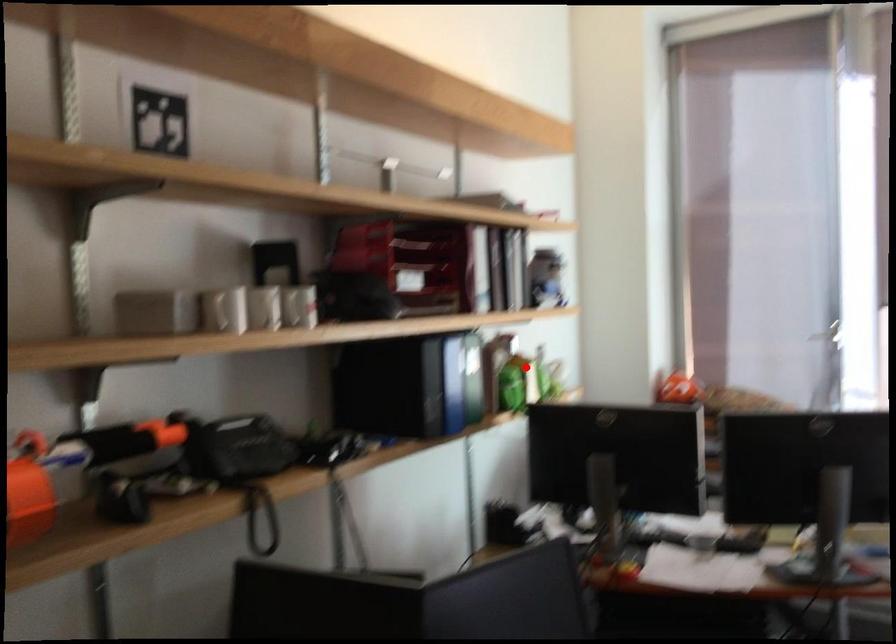
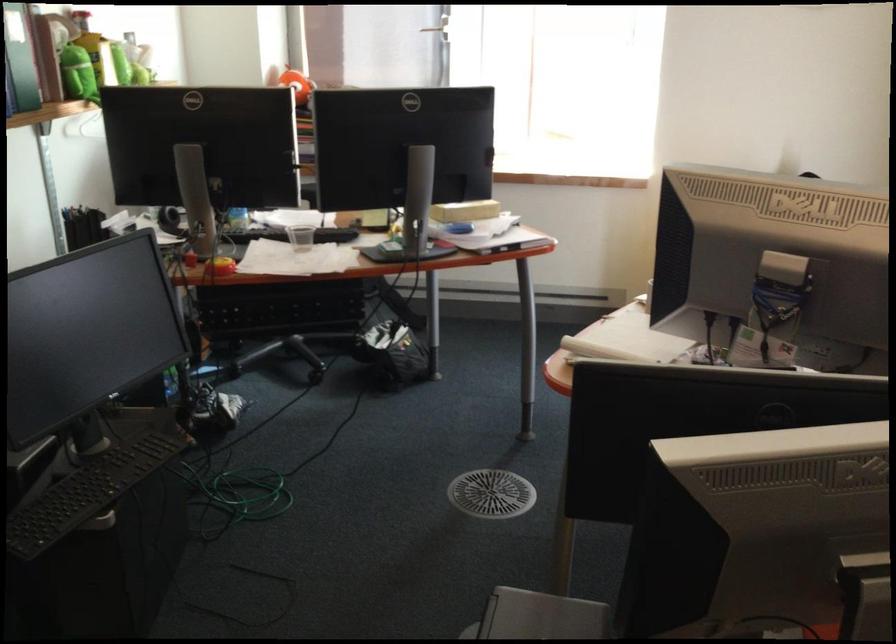
In the second image, find the point that corresponds to the highlighted location in the first image.

(95, 49)